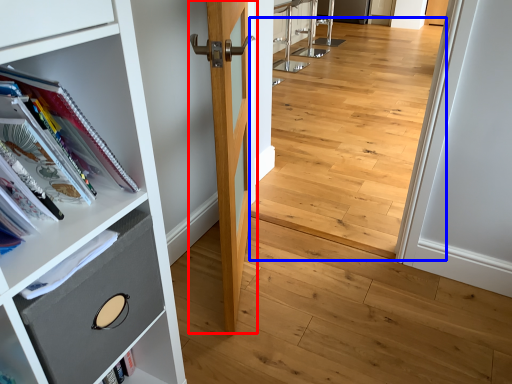
Question: Which object is further to the camera taking this photo, door (highlighted by a red box) or corridor (highlighted by a blue box)?

Choices:
 (A) door
 (B) corridor

Answer: (B)